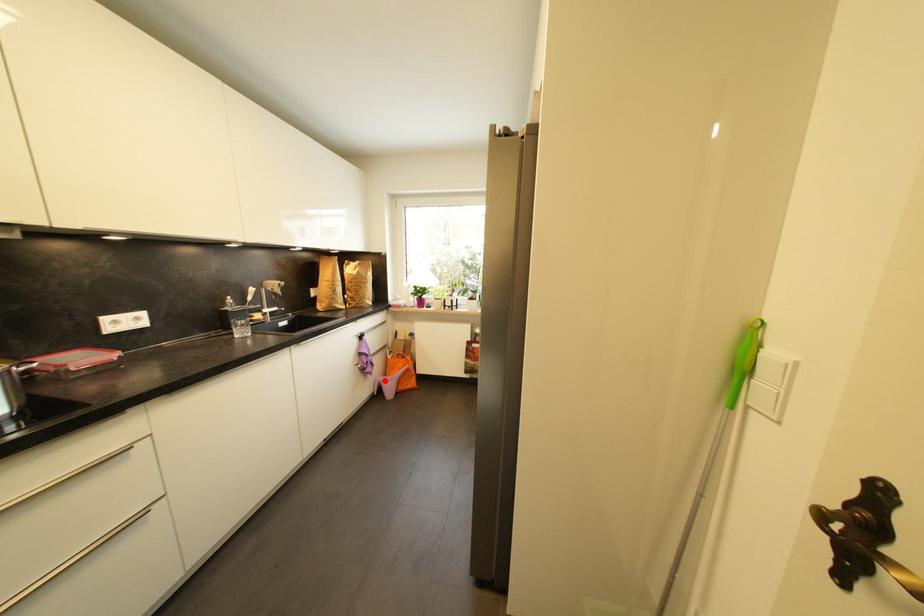
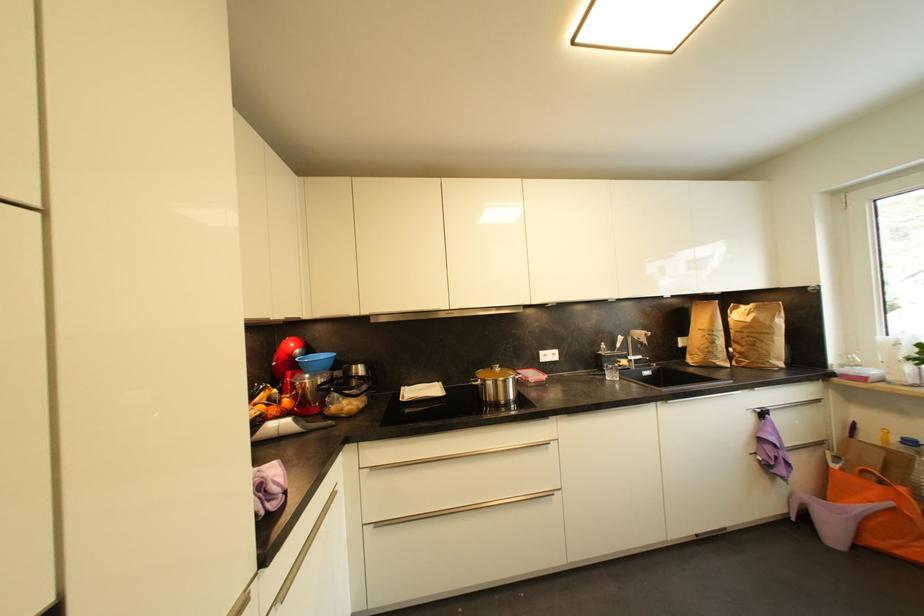
The point at the highlighted location is marked in the first image. Where is the corresponding point in the second image?

(811, 498)